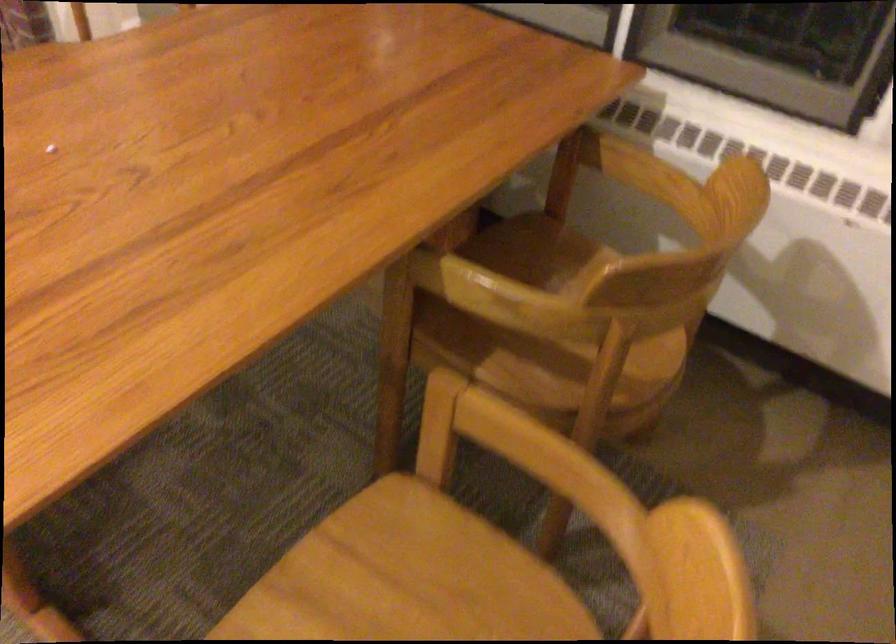
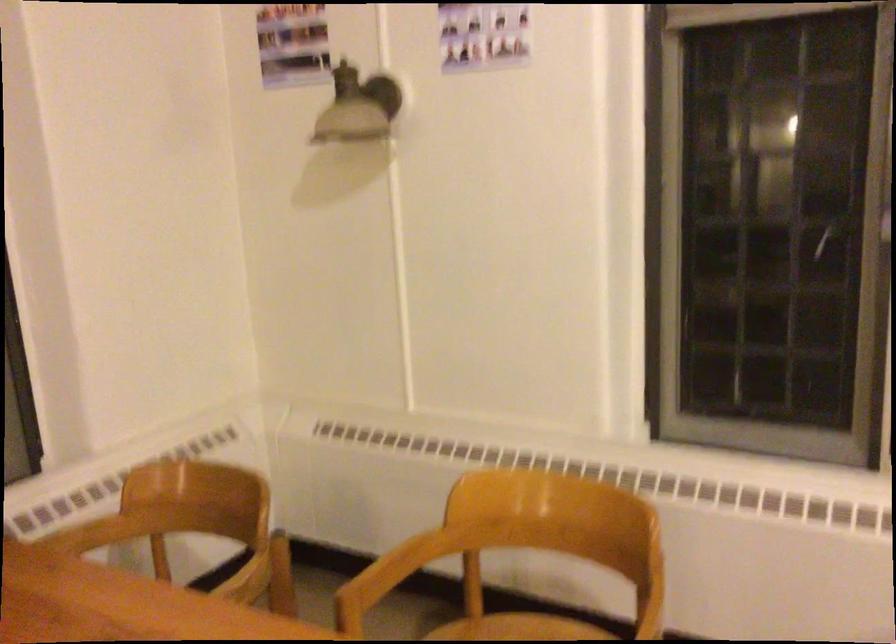
Locate, in the second image, the point that corresponds to (684,204) in the first image.

(92, 534)